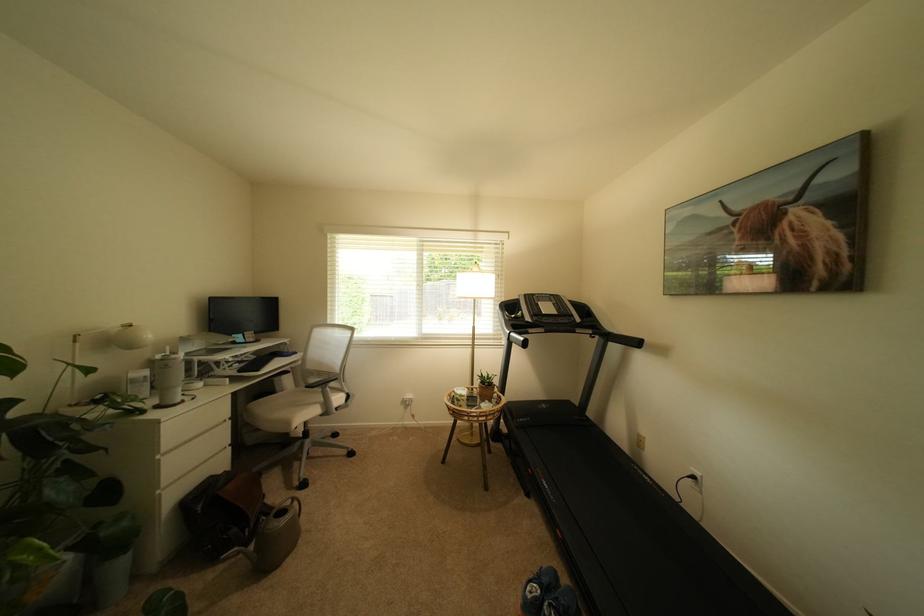
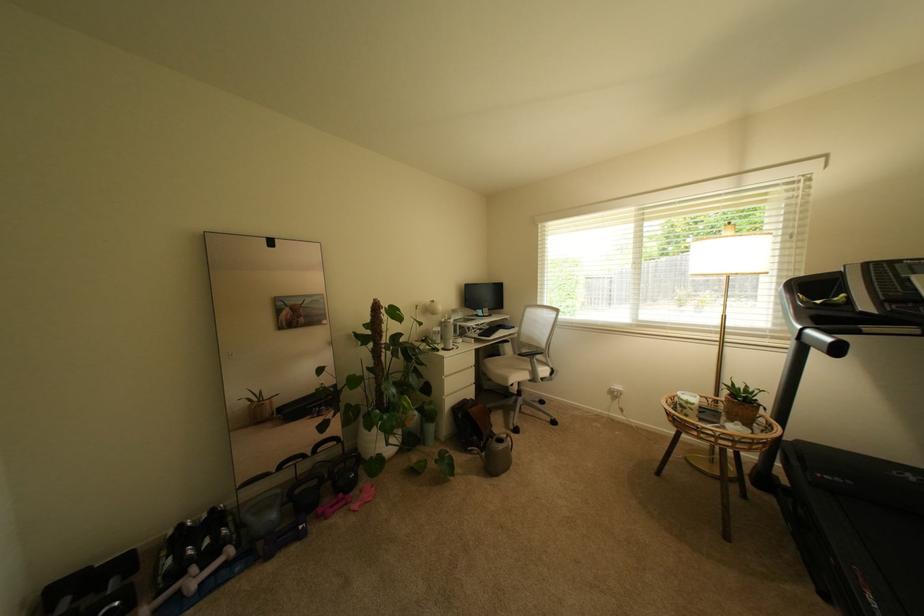
The point at (175, 480) is marked in the first image. Where is the corresponding point in the second image?

(455, 392)